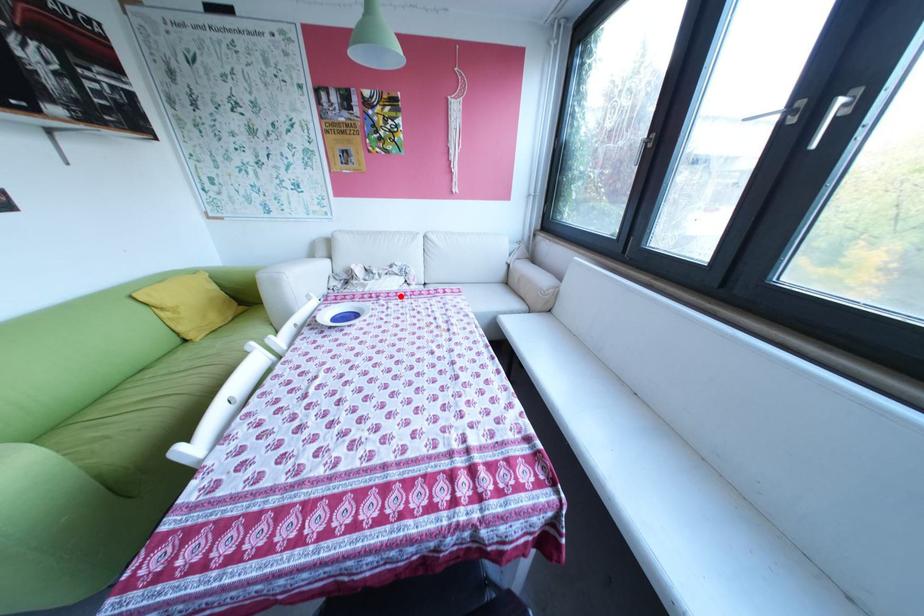
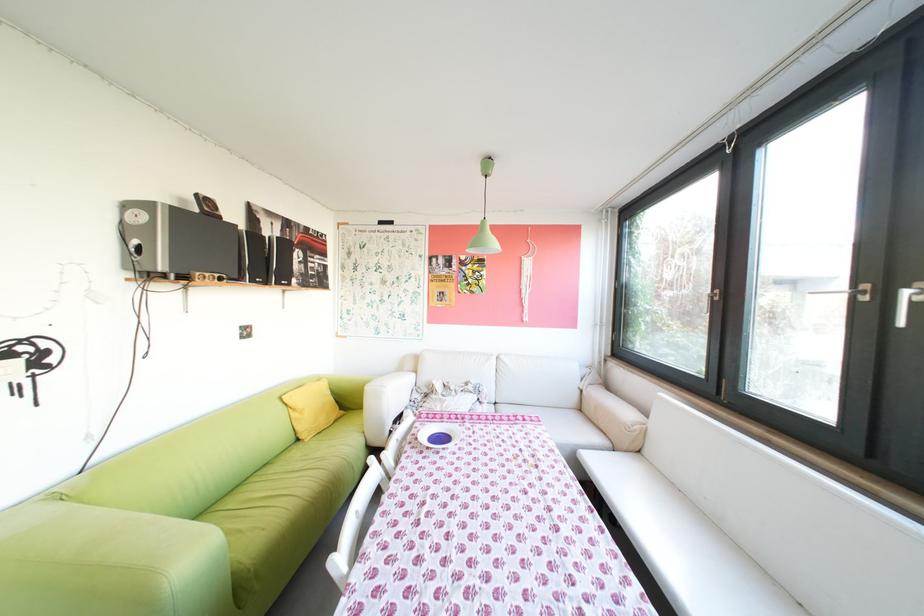
Question: I am providing you with two images of the same scene from different viewpoints. Image1 has a red point marked. In image2, the corresponding 3D location appears at what relative position? Reply with the corresponding letter.

Choices:
 (A) Closer
 (B) Farther

Answer: (A)